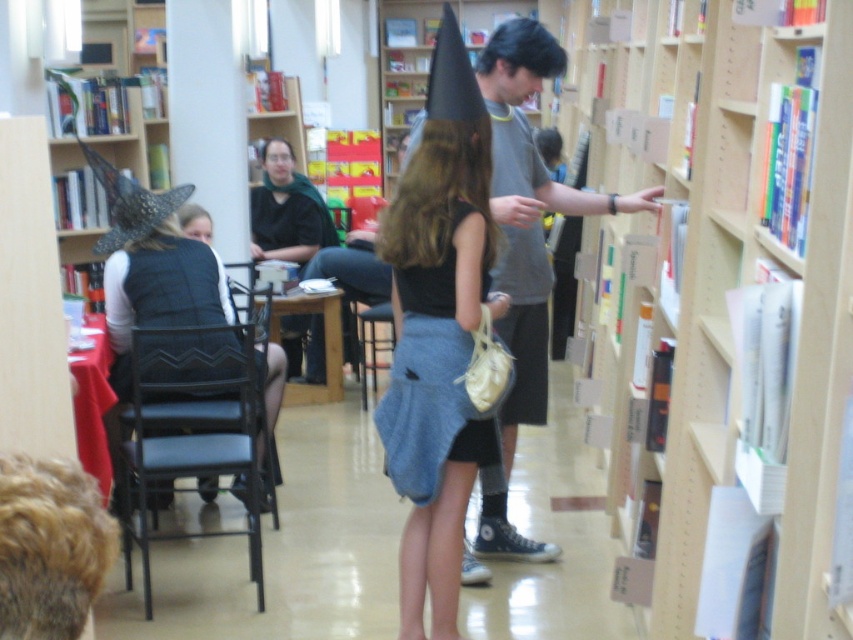
Does point (120, 161) come closer to viewer compared to point (383, 310)?

Yes.

Does wooden bookshelf at left have a larger size compared to black fabric chair at center?

Correct, wooden bookshelf at left is larger in size than black fabric chair at center.

Does point (227, 147) lie behind point (389, 304)?

No, it is not.

Find the location of `wooden bookshelf at left`. wooden bookshelf at left is located at coordinates (105, 138).

Who is more distant from viewer, (500,157) or (260,248)?

Positioned behind is point (260,248).

What do you see at coordinates (524, 262) in the screenshot? This screenshot has height=640, width=853. I see `gray cotton t-shirt at center` at bounding box center [524, 262].

Is point (502, 540) positioned before point (271, 179)?

Yes, point (502, 540) is closer to viewer.

Where is `gray cotton t-shirt at center`? The image size is (853, 640). gray cotton t-shirt at center is located at coordinates coord(524,262).

Which is in front, point (544, 273) or point (236, 470)?

Point (236, 470)

The height and width of the screenshot is (640, 853). Describe the element at coordinates (524, 262) in the screenshot. I see `gray cotton t-shirt at center` at that location.

Image resolution: width=853 pixels, height=640 pixels. In order to click on gray cotton t-shirt at center in this screenshot , I will do `click(524, 262)`.